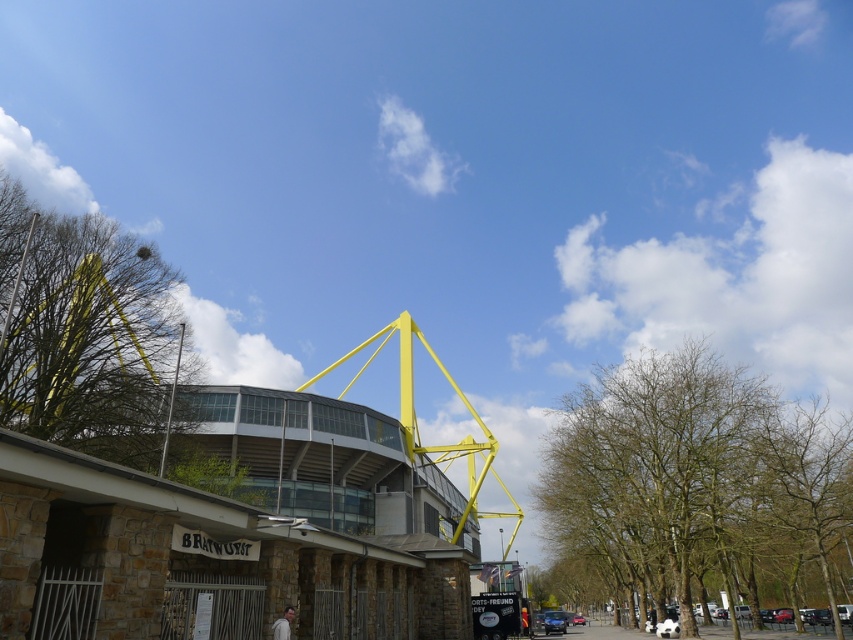
Question: Which object is closer to the camera taking this photo?

Choices:
 (A) green leafy tree at upper left
 (B) yellow metallic structure at center

Answer: (B)

Question: Is bare branches at center further to camera compared to green leafy tree at upper left?

Choices:
 (A) yes
 (B) no

Answer: (A)

Question: Which of these objects is positioned closest to the green leafy tree at upper left?

Choices:
 (A) bare branches at center
 (B) yellow metallic structure at center

Answer: (B)

Question: Is yellow metallic structure at center below green leafy tree at upper left?

Choices:
 (A) no
 (B) yes

Answer: (B)

Question: Which point is farther to the camera?

Choices:
 (A) yellow metallic structure at center
 (B) green leafy tree at upper left
 (C) bare branches at center

Answer: (C)

Question: Is bare branches at center thinner than green leafy tree at upper left?

Choices:
 (A) no
 (B) yes

Answer: (A)